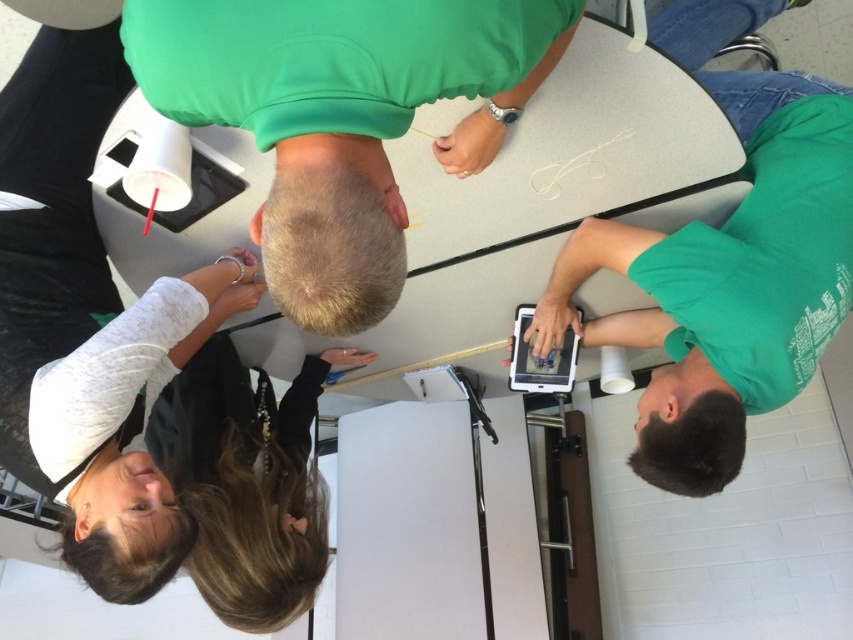
Does white matte cup at upper left have a lesser width compared to dark brown hair at lower left?

Correct, white matte cup at upper left's width is less than dark brown hair at lower left's.

Does white matte cup at upper left appear on the right side of dark brown hair at lower left?

In fact, white matte cup at upper left is to the left of dark brown hair at lower left.

Does point (3, 412) lie in front of point (281, 557)?

Yes.

At what (x,y) coordinates should I click in order to perform the action: click on white matte cup at upper left. Please return your answer as a coordinate pair (x, y). Looking at the image, I should click on (90, 324).

Is point (320, 209) positioned in front of point (311, 532)?

Yes, point (320, 209) is closer to viewer.

Measure the distance between green fabric headrest at upper center and camera.

The distance of green fabric headrest at upper center from camera is 30.14 inches.

Who is more distant from viewer, (495, 60) or (277, 458)?

The point (277, 458) is more distant.

The image size is (853, 640). Identify the location of green fabric headrest at upper center. (341, 116).

Does green fabric headrest at upper center have a lesser height compared to white matte cup at upper left?

Yes, green fabric headrest at upper center is shorter than white matte cup at upper left.

Between point (268, 218) and point (27, 68), which one is positioned behind?

The point (27, 68) is behind.

Is point (146, 12) closer to viewer compared to point (28, 406)?

Yes.

The height and width of the screenshot is (640, 853). Identify the location of green fabric headrest at upper center. (341, 116).